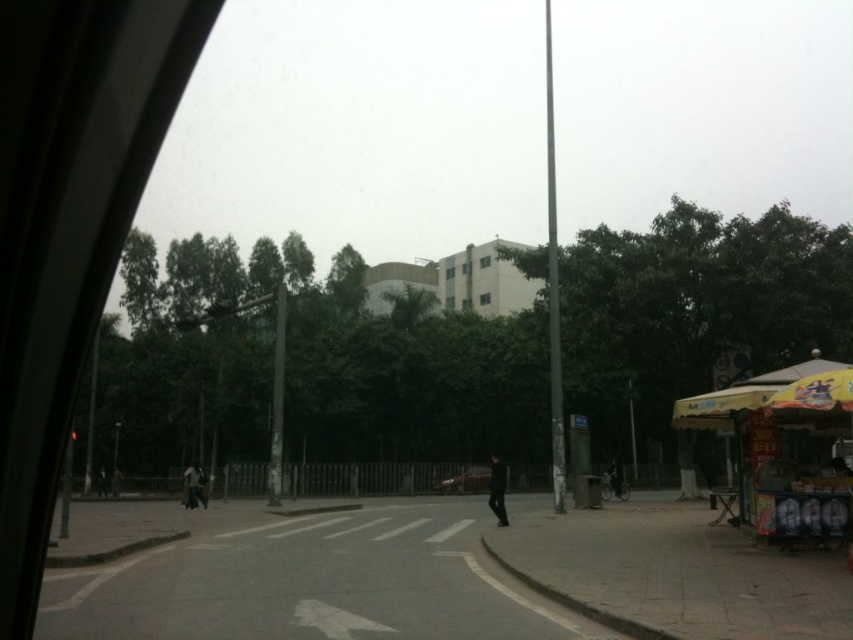
Question: Is silver metallic pole at center above smooth gray pole at center?

Choices:
 (A) yes
 (B) no

Answer: (A)

Question: Can you confirm if silver metallic pole at center is smaller than black matte person at lower left?

Choices:
 (A) no
 (B) yes

Answer: (A)

Question: Which object is farther from the camera taking this photo?

Choices:
 (A) shiny red car at center
 (B) black matte person at lower left
 (C) dark gray pants at center
 (D) metallic pole at left

Answer: (B)

Question: Which point is closer to the camera?

Choices:
 (A) smooth gray pole at center
 (B) black matte person at lower left

Answer: (A)

Question: Which object is positioned closest to the smooth gray pole at center?

Choices:
 (A) dark gray pants at center
 (B) dark gray jacket at left

Answer: (A)

Question: Does smooth gray pole at center appear on the right side of shiny red car at center?

Choices:
 (A) yes
 (B) no

Answer: (B)